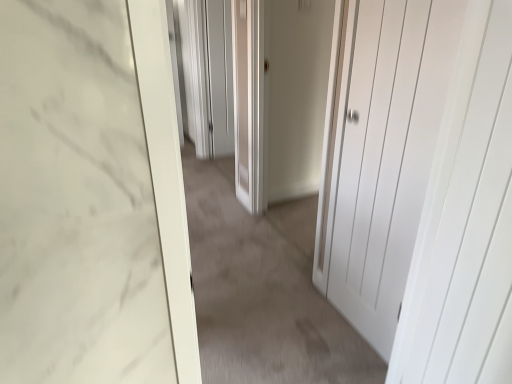
Question: From a real-world perspective, does white matte door at center sit lower than white matte door at center, the second door positioned from the right?

Choices:
 (A) no
 (B) yes

Answer: (B)

Question: Is white matte door at center not inside white matte door at center, which appears as the first door when viewed from the left?

Choices:
 (A) yes
 (B) no

Answer: (A)

Question: Considering the relative sizes of white matte door at center and white matte door at center, the second door positioned from the right, in the image provided, is white matte door at center bigger than white matte door at center, the second door positioned from the right,?

Choices:
 (A) yes
 (B) no

Answer: (B)

Question: From the image's perspective, is white matte door at center on white matte door at center, which appears as the first door when viewed from the left?

Choices:
 (A) no
 (B) yes

Answer: (A)

Question: Is the depth of white matte door at center less than that of white matte door at center, the second door positioned from the right?

Choices:
 (A) no
 (B) yes

Answer: (B)

Question: Is point (274, 168) closer or farther from the camera than point (197, 228)?

Choices:
 (A) closer
 (B) farther

Answer: (B)

Question: From the image's perspective, relative to white matte door at center, is white matte door at center, the second door positioned from the right, above or below?

Choices:
 (A) below
 (B) above

Answer: (B)

Question: From a real-world perspective, relative to white matte door at center, is white matte door at center, which appears as the first door when viewed from the left, vertically above or below?

Choices:
 (A) above
 (B) below

Answer: (A)

Question: Is white matte door at center, the second door positioned from the right, taller or shorter than white matte door at center?

Choices:
 (A) short
 (B) tall

Answer: (B)

Question: From their relative heights in the image, would you say white matte door at center is taller or shorter than white matte door at center, which is counted as the second door, starting from the left?

Choices:
 (A) tall
 (B) short

Answer: (B)

Question: From the image's perspective, is white matte door at center above or below white matte door at center, arranged as the 1th door when viewed from the right?

Choices:
 (A) below
 (B) above

Answer: (A)

Question: Considering their positions, is white matte door at center located in front of or behind white matte door at center, which is counted as the second door, starting from the left?

Choices:
 (A) behind
 (B) front

Answer: (A)

Question: Considering the positions of white matte door at center and white matte door at center, arranged as the 1th door when viewed from the right, in the image, is white matte door at center wider or thinner than white matte door at center, arranged as the 1th door when viewed from the right,?

Choices:
 (A) wide
 (B) thin

Answer: (A)

Question: Is matte gray screen door at center taller or shorter than white matte door at center?

Choices:
 (A) short
 (B) tall

Answer: (B)

Question: Relative to white matte door at center, is matte gray screen door at center in front or behind?

Choices:
 (A) front
 (B) behind

Answer: (B)